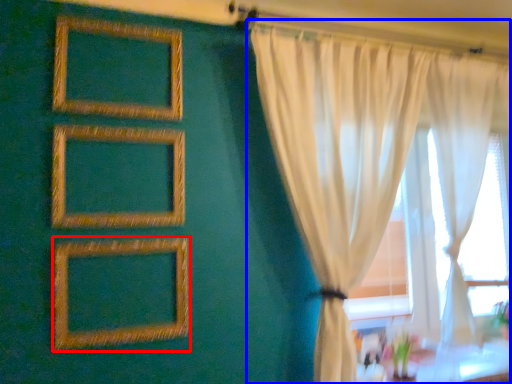
Question: Which point is further to the camera, picture frame (highlighted by a red box) or curtain (highlighted by a blue box)?

Choices:
 (A) picture frame
 (B) curtain

Answer: (B)